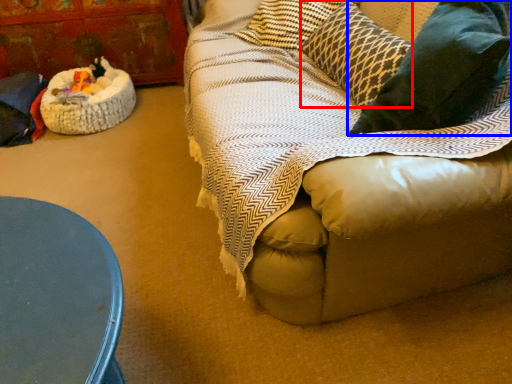
Question: Which object appears closest to the camera in this image, pillow (highlighted by a red box) or throw pillow (highlighted by a blue box)?

Choices:
 (A) pillow
 (B) throw pillow

Answer: (B)